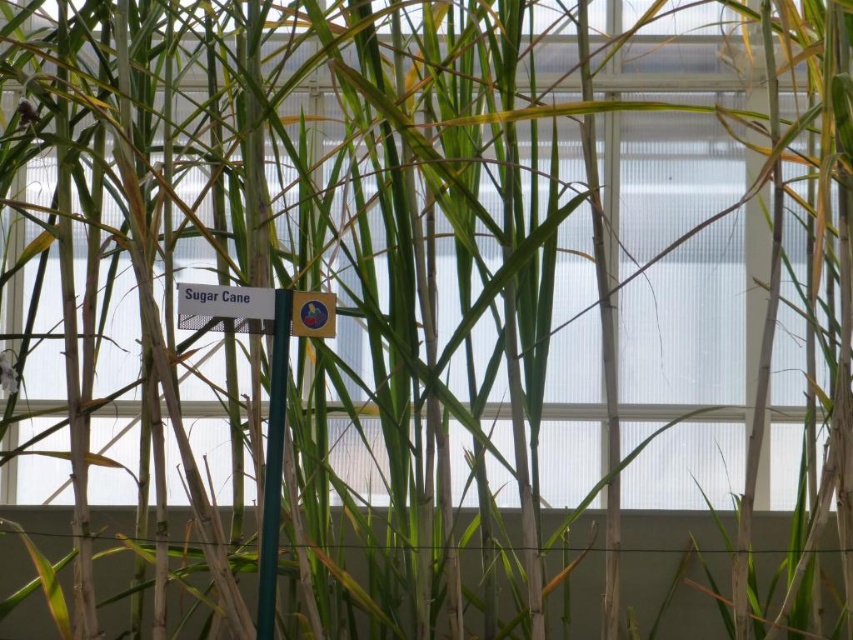
You are a gardener who needs to attach a new label to the shorter object between the green matte pole at center and the matte plastic sign at center in the greenhouse. Which object should you choose?

The matte plastic sign at center is shorter than the green matte pole at center, so you should attach the new label to the matte plastic sign at center.